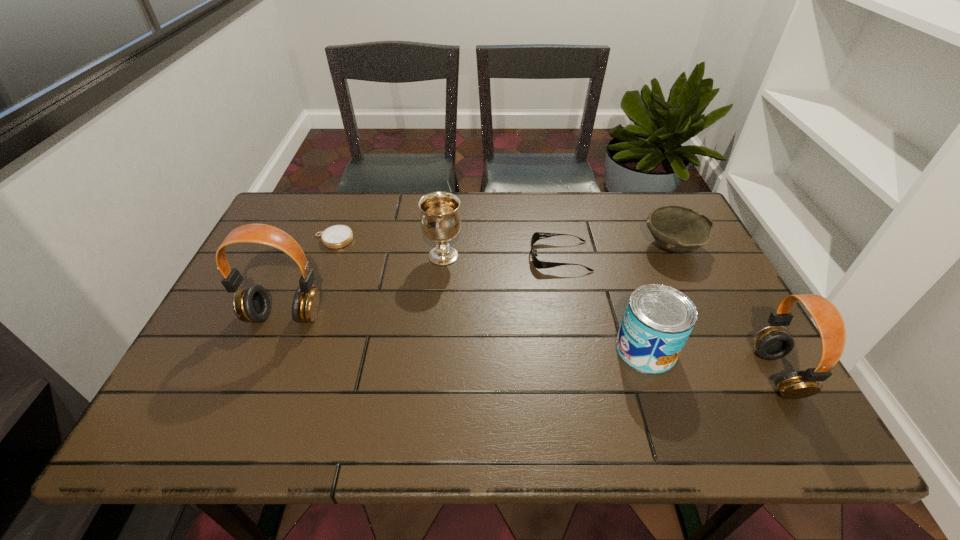
Locate an element on the screen. Image resolution: width=960 pixels, height=540 pixels. the fifth object from left to right is located at coordinates (658, 320).

Find the location of `the fourth shortest object`. the fourth shortest object is located at coordinates (658, 320).

Identify the location of vacant space located 0.080m on the ear cups of the tallest object. (267, 358).

Where is `free space located on the front-facing side of the second shortest object`? The width and height of the screenshot is (960, 540). free space located on the front-facing side of the second shortest object is located at coordinates (431, 256).

At what (x,y) coordinates should I click in order to perform the action: click on vacant space located on the front-facing side of the second shortest object. Please return your answer as a coordinate pair (x, y). The height and width of the screenshot is (540, 960). Looking at the image, I should click on (492, 256).

Find the location of a particular element. The height and width of the screenshot is (540, 960). free space located 0.340m on the front-facing side of the second shortest object is located at coordinates (410, 256).

The image size is (960, 540). Identify the location of vacant space positioned on the front of the bowl. (716, 335).

I want to click on vacant position located on the front of the fifth shortest object, so click(435, 349).

This screenshot has height=540, width=960. What are the coordinates of `vacant space situated 0.150m on the left of the shortest object` in the screenshot? It's located at (263, 239).

Locate an element on the screen. free space located 0.060m on the right of the third object from right to left is located at coordinates (702, 349).